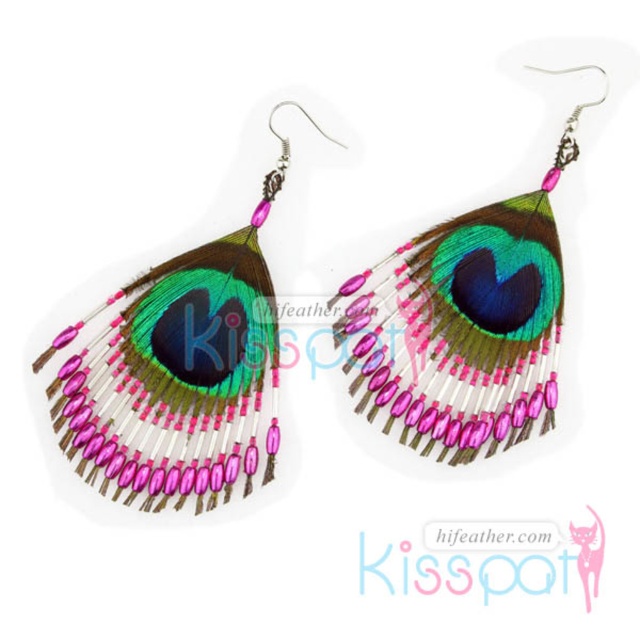
Question: Does multicolored feather earrings at left appear over multicolored feather earrings at center?

Choices:
 (A) no
 (B) yes

Answer: (A)

Question: Among these objects, which one is nearest to the camera?

Choices:
 (A) multicolored feather earrings at left
 (B) multicolored feather earrings at center

Answer: (A)

Question: In this image, where is multicolored feather earrings at left located relative to multicolored feather earrings at center?

Choices:
 (A) left
 (B) right

Answer: (A)

Question: Which of the following is the closest to the observer?

Choices:
 (A) multicolored feather earrings at center
 (B) multicolored feather earrings at left

Answer: (B)

Question: Which point is closer to the camera?

Choices:
 (A) (198, 348)
 (B) (536, 280)

Answer: (B)

Question: Can you confirm if multicolored feather earrings at left is positioned to the right of multicolored feather earrings at center?

Choices:
 (A) yes
 (B) no

Answer: (B)